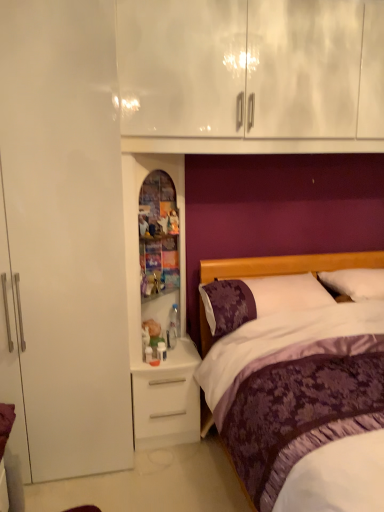
Question: Is the position of white matte desk at lower center less distant than that of purple satin bed at center?

Choices:
 (A) no
 (B) yes

Answer: (A)

Question: Is white matte desk at lower center positioned behind purple satin bed at center?

Choices:
 (A) yes
 (B) no

Answer: (A)

Question: Does white matte desk at lower center have a larger size compared to purple satin bed at center?

Choices:
 (A) no
 (B) yes

Answer: (A)

Question: Is white matte desk at lower center shorter than purple satin bed at center?

Choices:
 (A) yes
 (B) no

Answer: (A)

Question: Is white matte desk at lower center at the left side of purple satin bed at center?

Choices:
 (A) no
 (B) yes

Answer: (B)

Question: From the image's perspective, is white matte desk at lower center positioned above or below purple floral pillow at right, the 1th pillow in the left-to-right sequence?

Choices:
 (A) above
 (B) below

Answer: (B)

Question: Looking at the image, does white matte desk at lower center seem bigger or smaller compared to purple floral pillow at right, the 1th pillow in the left-to-right sequence?

Choices:
 (A) small
 (B) big

Answer: (B)

Question: Do you think white matte desk at lower center is within purple floral pillow at right, the 1th pillow in the left-to-right sequence, or outside of it?

Choices:
 (A) outside
 (B) inside

Answer: (A)

Question: Is point (188, 402) closer or farther from the camera than point (233, 321)?

Choices:
 (A) farther
 (B) closer

Answer: (A)

Question: Based on their positions, is purple floral pillow at right, which appears as the second pillow when viewed from the right, located to the left or right of purple satin pillow at right, which appears as the 2th pillow when viewed from the left?

Choices:
 (A) left
 (B) right

Answer: (A)

Question: From a real-world perspective, is purple floral pillow at right, which appears as the second pillow when viewed from the right, above or below purple satin pillow at right, the first pillow when ordered from right to left?

Choices:
 (A) above
 (B) below

Answer: (B)

Question: Would you say purple floral pillow at right, which appears as the second pillow when viewed from the right, is inside or outside purple satin pillow at right, the first pillow when ordered from right to left?

Choices:
 (A) inside
 (B) outside

Answer: (B)

Question: Is point (271, 279) positioned closer to the camera than point (345, 290)?

Choices:
 (A) farther
 (B) closer

Answer: (A)

Question: Considering the positions of purple satin pillow at right, which appears as the 2th pillow when viewed from the left, and white matte desk at lower center in the image, is purple satin pillow at right, which appears as the 2th pillow when viewed from the left, taller or shorter than white matte desk at lower center?

Choices:
 (A) short
 (B) tall

Answer: (A)

Question: From the image's perspective, is purple satin pillow at right, the first pillow when ordered from right to left, above or below white matte desk at lower center?

Choices:
 (A) below
 (B) above

Answer: (B)